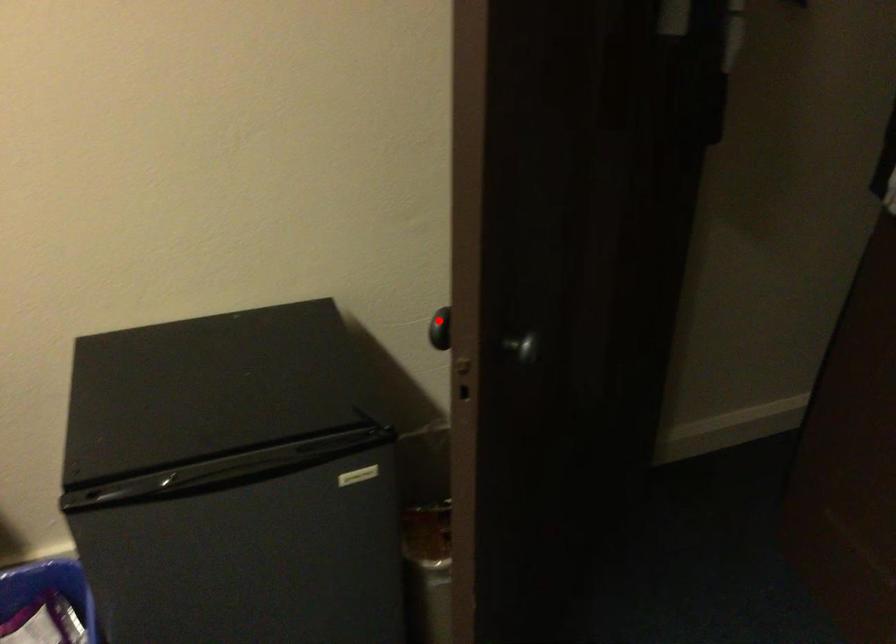
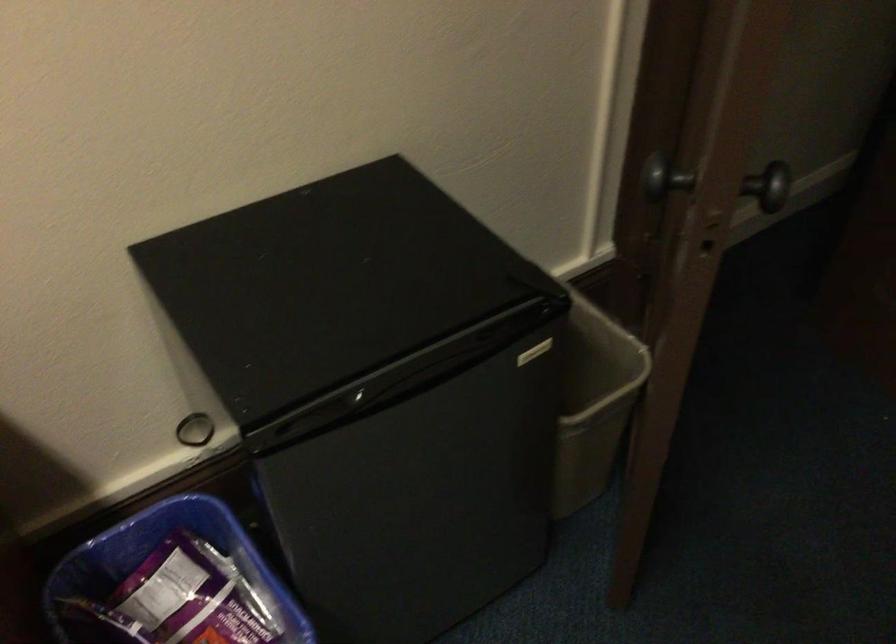
Question: I am providing you with two images of the same scene from different viewpoints. A red point is marked on the first image. Is the red point's position out of view in image 2?

Choices:
 (A) Yes
 (B) No

Answer: (B)